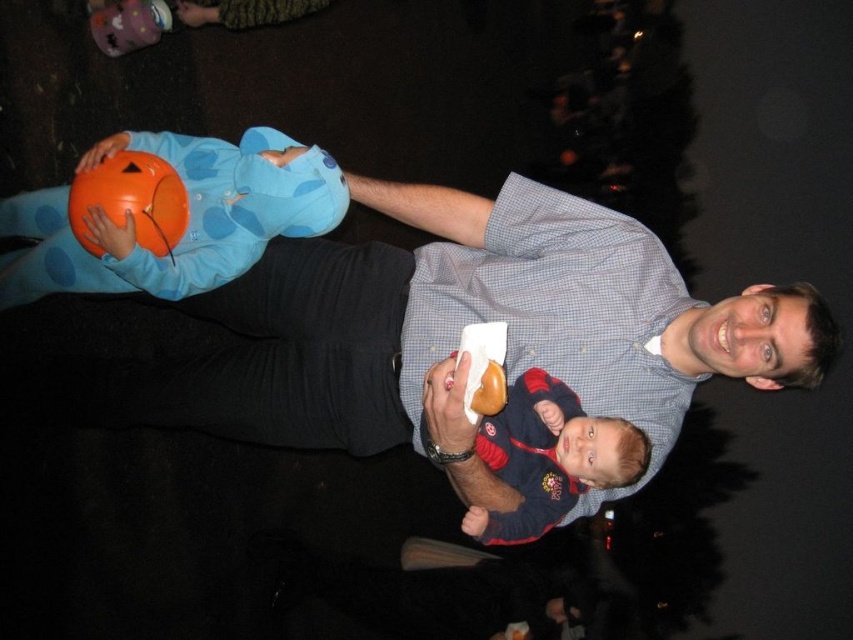
Question: Does matte blue shirt at center have a larger size compared to matte blue sweater at center?

Choices:
 (A) yes
 (B) no

Answer: (A)

Question: Can you confirm if blue polka dot costume at left is positioned to the left of matte blue sweater at center?

Choices:
 (A) no
 (B) yes

Answer: (B)

Question: Which object appears closest to the camera in this image?

Choices:
 (A) blue polka dot costume at left
 (B) matte blue shirt at center

Answer: (B)

Question: Is matte blue shirt at center thinner than matte blue sweater at center?

Choices:
 (A) yes
 (B) no

Answer: (B)

Question: Among these points, which one is nearest to the camera?

Choices:
 (A) (646, 460)
 (B) (132, 360)
 (C) (228, 204)

Answer: (A)

Question: Which point is farther from the camera taking this photo?

Choices:
 (A) (624, 467)
 (B) (138, 268)

Answer: (B)